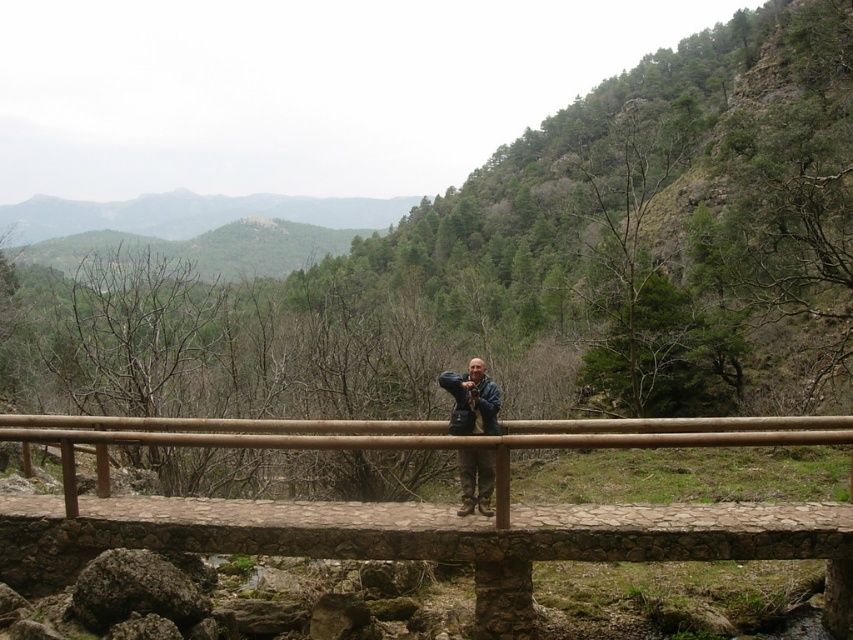
You are standing at the point marked by the coordinate point (444, 506) on the brown wooden bridge at center. You want to walk to the nearest edge of the bridge. In which direction should you move?

The nearest edge of the brown wooden bridge at center from the point (444, 506) would be to the left, as the coordinate is closer to the left side of the bridge.

You are a photographer standing on the brown wooden bridge at center, wearing the blue denim jacket at center. You want to take a photo of the distant mountains. Since the bridge is lower than your jacket, will you need to bend down to frame the mountains properly?

The brown wooden bridge at center has a lesser height compared to blue denim jacket at center, so you would need to bend down slightly to frame the mountains properly since the bridge surface is lower than your jacket height.

You are a photographer positioned on the stone bridge and want to ensure your blue denim jacket at center is visible in the photo you are taking of the brown wooden bridge at center. Based on the scene, will the jacket be visible in the photo?

The blue denim jacket at center is behind the brown wooden bridge at center, so it will not be visible in the photo of the brown wooden bridge at center.